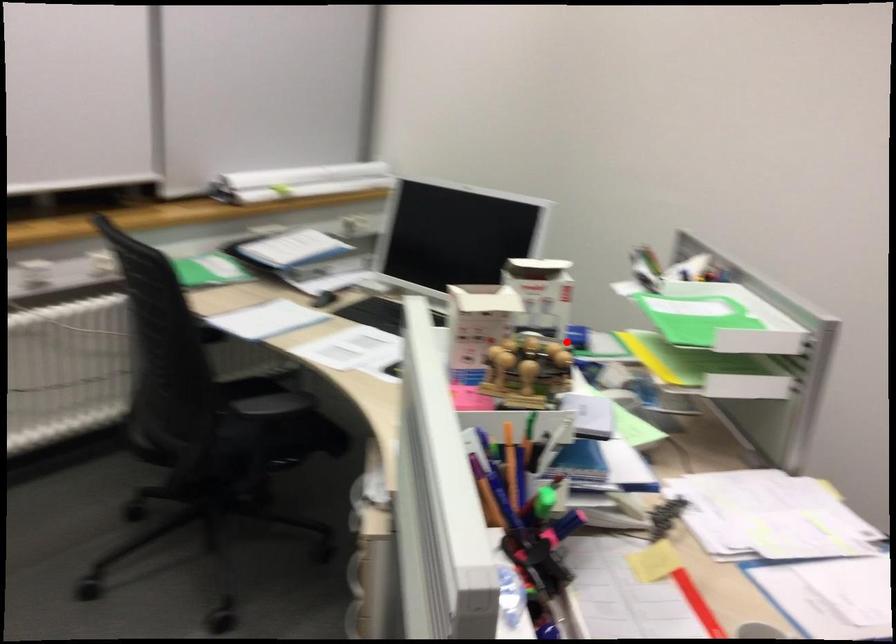
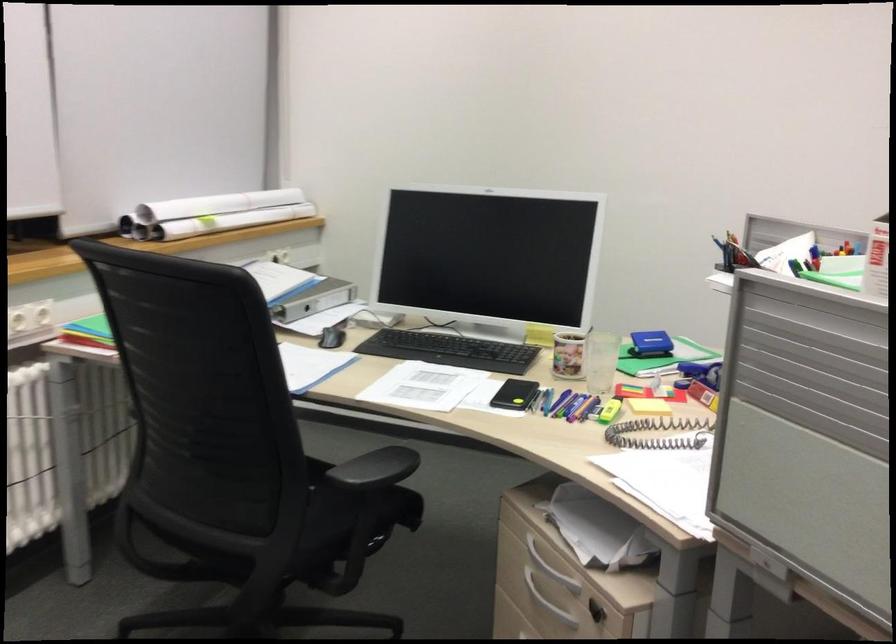
The point at the highlighted location is marked in the first image. Where is the corresponding point in the second image?

(650, 344)